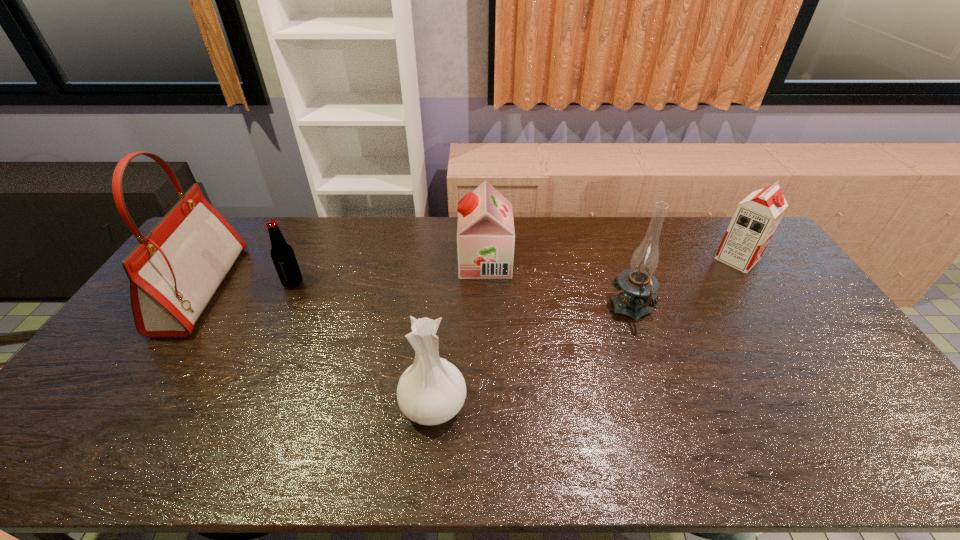
The image size is (960, 540). I want to click on blank area in the image that satisfies the following two spatial constraints: 1. on the back side of the right soya milk; 2. on the right side of the vase, so click(x=446, y=259).

Image resolution: width=960 pixels, height=540 pixels. Find the location of `free spot that satisfies the following two spatial constraints: 1. on the front side of the fifth object from right to left; 2. on the left side of the second tallest object`. free spot that satisfies the following two spatial constraints: 1. on the front side of the fifth object from right to left; 2. on the left side of the second tallest object is located at coordinates (281, 309).

Where is `free space in the image that satisfies the following two spatial constraints: 1. with the cap open on the oil lamp; 2. on the right side of the left soya milk`? free space in the image that satisfies the following two spatial constraints: 1. with the cap open on the oil lamp; 2. on the right side of the left soya milk is located at coordinates (486, 309).

Locate an element on the screen. vacant space that satisfies the following two spatial constraints: 1. on the back side of the nearest object; 2. on the left side of the fifth object from left to right is located at coordinates (442, 309).